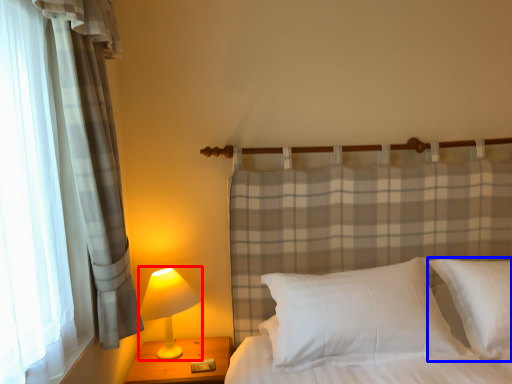
Question: Among these objects, which one is nearest to the camera, lamp (highlighted by a red box) or pillow (highlighted by a blue box)?

Choices:
 (A) lamp
 (B) pillow

Answer: (B)